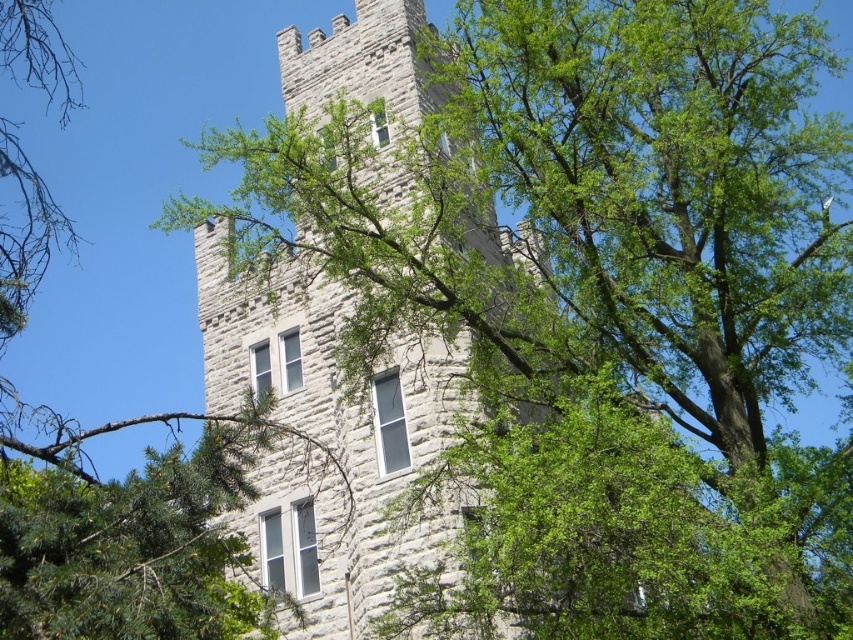
You are standing in a medieval village and see the gray stone tower at center. A friendly local tells you that the distance between you and the tower is exactly 179.47 feet. If you want to move closer to the tower by 50 feet, how far will you be from the tower then?

After moving 50 feet closer, you will be 129.47 feet away from the gray stone tower at center.

You are a bird flying at an altitude of 100 feet. You want to land on the gray stone tower at center but need to avoid the green leafy tree at center. Based on their distance, can you safely land on the tower without hitting the tree?

The gray stone tower at center is 166.76 feet away from the green leafy tree at center. Since the bird is flying at 100 feet altitude, the horizontal distance between them is greater than the bird s altitude, so it can safely land on the tower without hitting the tree.